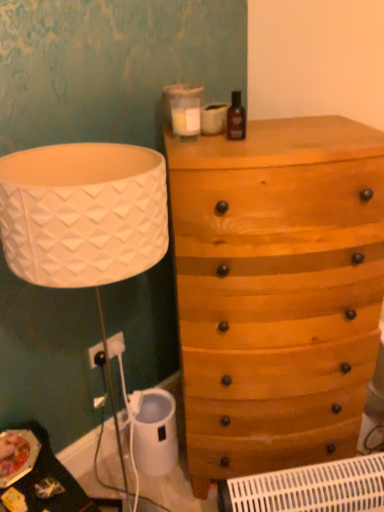
Question: Does white plastic radiator at lower center have a lesser height compared to wooden chest of drawers at upper right?

Choices:
 (A) no
 (B) yes

Answer: (B)

Question: Does white plastic radiator at lower center contain wooden chest of drawers at upper right?

Choices:
 (A) no
 (B) yes

Answer: (A)

Question: Is white plastic radiator at lower center placed right next to wooden chest of drawers at upper right?

Choices:
 (A) yes
 (B) no

Answer: (B)

Question: From the image's perspective, does white plastic radiator at lower center appear lower than wooden chest of drawers at upper right?

Choices:
 (A) no
 (B) yes

Answer: (B)

Question: Could you tell me if white plastic radiator at lower center is turned towards wooden chest of drawers at upper right?

Choices:
 (A) no
 (B) yes

Answer: (A)

Question: From a real-world perspective, is wooden chest of drawers at upper right above or below brown glass bottle at upper center?

Choices:
 (A) below
 (B) above

Answer: (A)

Question: Relative to brown glass bottle at upper center, is wooden chest of drawers at upper right in front or behind?

Choices:
 (A) front
 (B) behind

Answer: (A)

Question: From their relative heights in the image, would you say wooden chest of drawers at upper right is taller or shorter than brown glass bottle at upper center?

Choices:
 (A) tall
 (B) short

Answer: (A)

Question: Based on their sizes in the image, would you say wooden chest of drawers at upper right is bigger or smaller than brown glass bottle at upper center?

Choices:
 (A) big
 (B) small

Answer: (A)

Question: Is white plastic electric outlet at lower left in front of or behind white plastic radiator at lower center in the image?

Choices:
 (A) front
 (B) behind

Answer: (B)

Question: Based on their sizes in the image, would you say white plastic electric outlet at lower left is bigger or smaller than white plastic radiator at lower center?

Choices:
 (A) small
 (B) big

Answer: (A)

Question: Visually, is white plastic electric outlet at lower left positioned to the left or to the right of white plastic radiator at lower center?

Choices:
 (A) right
 (B) left

Answer: (B)

Question: Do you think white plastic electric outlet at lower left is within white plastic radiator at lower center, or outside of it?

Choices:
 (A) inside
 (B) outside

Answer: (B)

Question: From a real-world perspective, is wooden chest of drawers at upper right above or below white plastic radiator at lower center?

Choices:
 (A) above
 (B) below

Answer: (A)

Question: Does point (218, 227) appear closer or farther from the camera than point (241, 503)?

Choices:
 (A) closer
 (B) farther

Answer: (A)